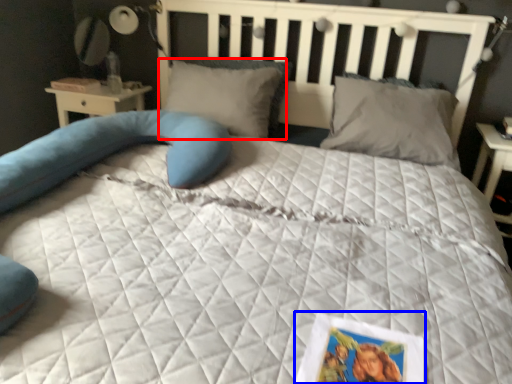
Question: Among these objects, which one is farthest to the camera, pillow (highlighted by a red box) or postcard (highlighted by a blue box)?

Choices:
 (A) pillow
 (B) postcard

Answer: (A)